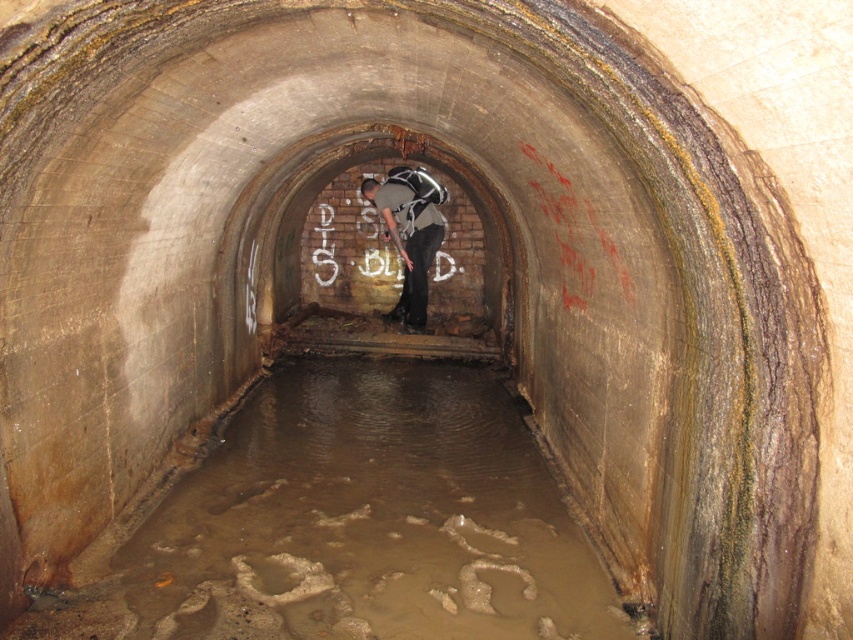
Question: Among these objects, which one is farthest from the camera?

Choices:
 (A) muddy concrete flood at center
 (B) white chalk graffiti at center
 (C) gray fabric backpack at center

Answer: (B)

Question: Which point is farther to the camera?

Choices:
 (A) muddy concrete flood at center
 (B) white chalk graffiti at center

Answer: (B)

Question: Which object appears closest to the camera in this image?

Choices:
 (A) gray fabric backpack at center
 (B) muddy concrete flood at center

Answer: (B)

Question: Is muddy concrete flood at center smaller than white chalk graffiti at center?

Choices:
 (A) yes
 (B) no

Answer: (B)

Question: Does muddy concrete flood at center appear over gray fabric backpack at center?

Choices:
 (A) no
 (B) yes

Answer: (A)

Question: Does muddy concrete flood at center have a larger size compared to white chalk graffiti at center?

Choices:
 (A) no
 (B) yes

Answer: (B)